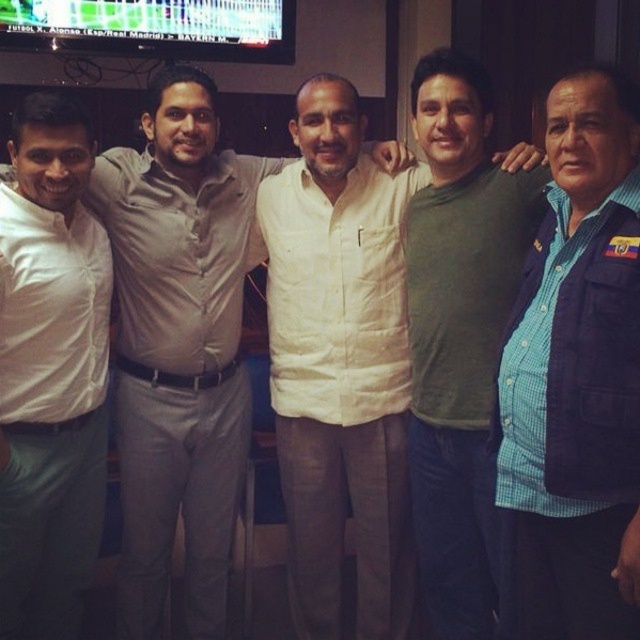
Question: Which object appears closest to the camera in this image?

Choices:
 (A) white matte shirt at left
 (B) white cotton shirt at center

Answer: (A)

Question: Is blue checkered shirt at right bigger than green matte shirt at center?

Choices:
 (A) yes
 (B) no

Answer: (B)

Question: Which of the following is the closest to the observer?

Choices:
 (A) (488, 317)
 (B) (385, 369)
 (C) (179, 236)

Answer: (A)

Question: Can you confirm if white cotton shirt at center is wider than white matte shirt at left?

Choices:
 (A) no
 (B) yes

Answer: (B)

Question: Is blue checkered shirt at right positioned behind white cotton shirt at center?

Choices:
 (A) yes
 (B) no

Answer: (B)

Question: Which of the following is the farthest from the observer?

Choices:
 (A) blue checkered shirt at right
 (B) white cotton shirt at center

Answer: (B)